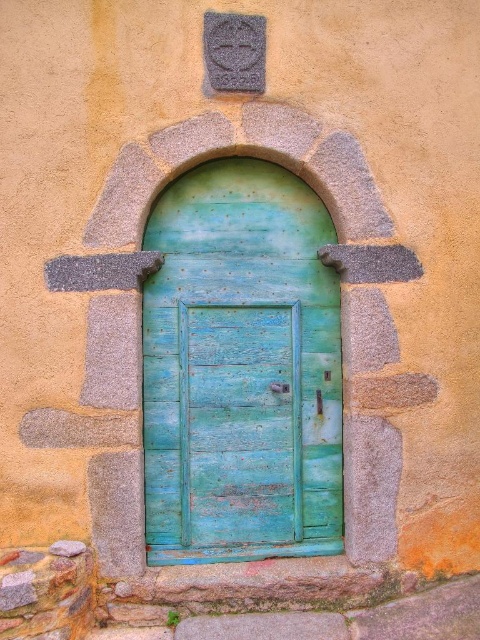
Is blue wooden door at center further to camera compared to weathered teal wood door at center?

No, blue wooden door at center is in front of weathered teal wood door at center.

In the scene shown: Who is positioned more to the right, blue wooden door at center or weathered teal wood door at center?

blue wooden door at center is more to the right.

Where is `blue wooden door at center`? The width and height of the screenshot is (480, 640). blue wooden door at center is located at coordinates (240, 369).

You are a GUI agent. You are given a task and a screenshot of the screen. Output one action in this format:
    pyautogui.click(x=<x>, y=<y>)
    Task: Click on the blue wooden door at center
    Image resolution: width=480 pixels, height=640 pixels.
    Given the screenshot: What is the action you would take?
    pyautogui.click(x=240, y=369)